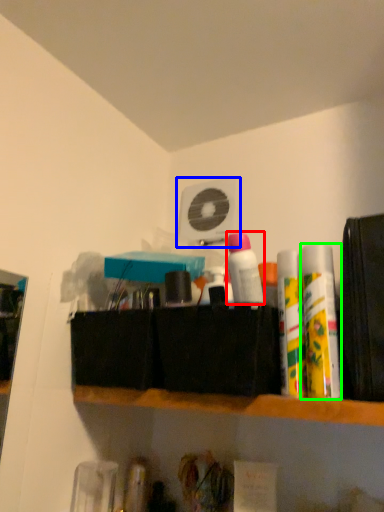
Question: Which object is the farthest from toiletry (highlighted by a red box)? Choose among these: fan (highlighted by a blue box) or toiletry (highlighted by a green box).

Choices:
 (A) fan
 (B) toiletry

Answer: (A)